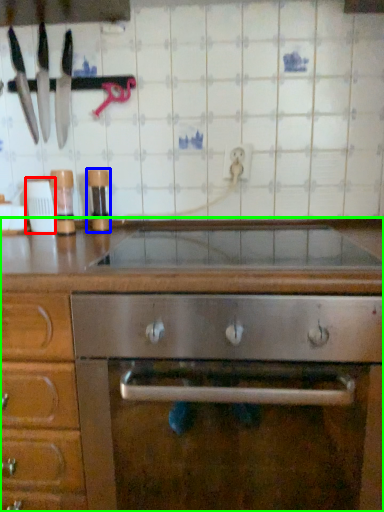
Question: Which object is the closest to the appliance (highlighted by a red box)? Choose among these: appliance (highlighted by a blue box) or cabinetry (highlighted by a green box).

Choices:
 (A) appliance
 (B) cabinetry

Answer: (A)